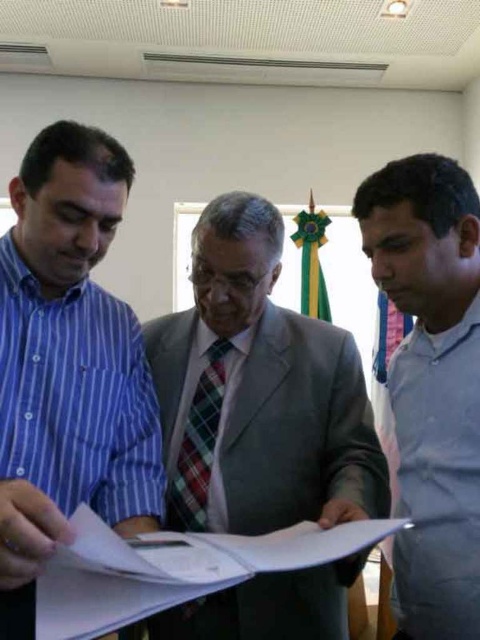
Is blue striped shirt at left to the right of gray smooth shirt at right from the viewer's perspective?

In fact, blue striped shirt at left is to the left of gray smooth shirt at right.

Does blue striped shirt at left have a smaller size compared to gray smooth shirt at right?

Incorrect, blue striped shirt at left is not smaller in size than gray smooth shirt at right.

Who is more distant from viewer, (110, 515) or (410, 186)?

The point (110, 515) is behind.

Identify the location of blue striped shirt at left. (68, 364).

Between gray suit at center and gray smooth shirt at right, which one is positioned lower?

gray suit at center is below.

What do you see at coordinates (259, 392) in the screenshot? The image size is (480, 640). I see `gray suit at center` at bounding box center [259, 392].

Does point (285, 515) come behind point (450, 444)?

Yes, point (285, 515) is farther from viewer.

At what (x,y) coordinates should I click in order to perform the action: click on gray suit at center. Please return your answer as a coordinate pair (x, y). This screenshot has width=480, height=640. Looking at the image, I should click on (259, 392).

Does gray smooth shirt at right appear over white paper at center?

Yes.

Is point (432, 452) positioned after point (343, 545)?

Yes, point (432, 452) is behind point (343, 545).

Identify the location of gray smooth shirt at right. (430, 321).